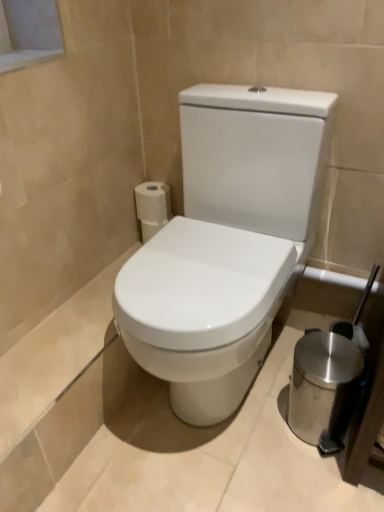
Question: Are polished stainless steel trash can at lower right and white matte toilet paper at upper left beside each other?

Choices:
 (A) yes
 (B) no

Answer: (B)

Question: Is polished stainless steel trash can at lower right taller than white matte toilet paper at upper left?

Choices:
 (A) no
 (B) yes

Answer: (B)

Question: Is polished stainless steel trash can at lower right shorter than white matte toilet paper at upper left?

Choices:
 (A) yes
 (B) no

Answer: (B)

Question: Is polished stainless steel trash can at lower right smaller than white matte toilet paper at upper left?

Choices:
 (A) yes
 (B) no

Answer: (B)

Question: Could you tell me if polished stainless steel trash can at lower right is turned towards white matte toilet paper at upper left?

Choices:
 (A) yes
 (B) no

Answer: (B)

Question: Based on their positions, is white glossy toilet at center located to the left or right of white matte toilet paper at upper left?

Choices:
 (A) left
 (B) right

Answer: (B)

Question: Looking at their shapes, would you say white glossy toilet at center is wider or thinner than white matte toilet paper at upper left?

Choices:
 (A) wide
 (B) thin

Answer: (A)

Question: From a real-world perspective, is white glossy toilet at center physically located above or below white matte toilet paper at upper left?

Choices:
 (A) above
 (B) below

Answer: (B)

Question: From the image's perspective, is white glossy toilet at center positioned above or below white matte toilet paper at upper left?

Choices:
 (A) above
 (B) below

Answer: (B)

Question: Considering the positions of white matte toilet paper at upper left and polished stainless steel trash can at lower right in the image, is white matte toilet paper at upper left bigger or smaller than polished stainless steel trash can at lower right?

Choices:
 (A) small
 (B) big

Answer: (A)

Question: Based on their positions, is white matte toilet paper at upper left located to the left or right of polished stainless steel trash can at lower right?

Choices:
 (A) left
 (B) right

Answer: (A)

Question: Does point (137, 196) appear closer or farther from the camera than point (311, 393)?

Choices:
 (A) closer
 (B) farther

Answer: (B)

Question: Would you say white matte toilet paper at upper left is inside or outside polished stainless steel trash can at lower right?

Choices:
 (A) outside
 (B) inside

Answer: (A)

Question: From the image's perspective, is white glossy toilet at center above or below polished stainless steel trash can at lower right?

Choices:
 (A) above
 (B) below

Answer: (A)

Question: Is white glossy toilet at center in front of or behind polished stainless steel trash can at lower right in the image?

Choices:
 (A) behind
 (B) front

Answer: (B)